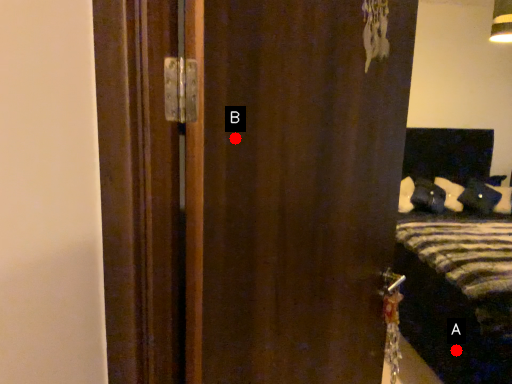
Question: Two points are circled on the image, labeled by A and B beside each circle. Among these points, which one is farthest from the camera?

Choices:
 (A) A is further
 (B) B is further

Answer: (A)